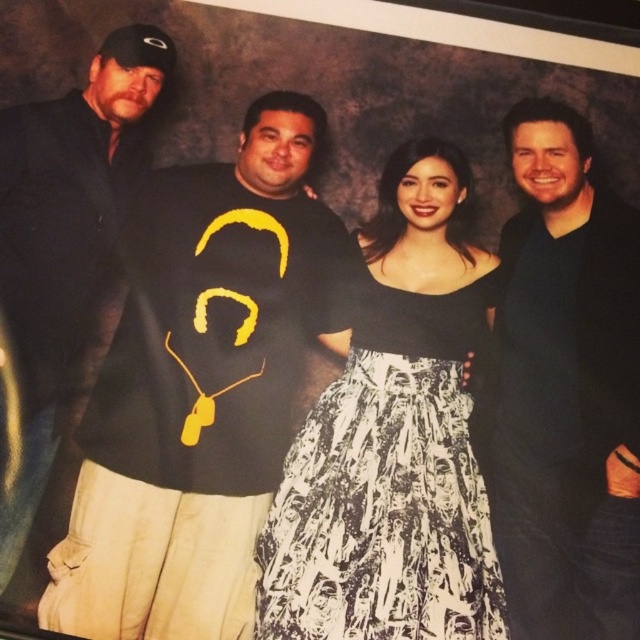
Question: Can you confirm if black matte t-shirt at center is smaller than black matte shirt at right?

Choices:
 (A) no
 (B) yes

Answer: (A)

Question: Which of the following is the farthest from the observer?

Choices:
 (A) black matte t-shirt at center
 (B) black matte jacket at upper left

Answer: (B)

Question: Which of the following is the closest to the observer?

Choices:
 (A) (92, 60)
 (B) (504, 241)

Answer: (A)

Question: From the image, what is the correct spatial relationship of black matte t-shirt at center in relation to black matte jacket at upper left?

Choices:
 (A) left
 (B) right

Answer: (B)

Question: Which point is closer to the camera taking this photo?

Choices:
 (A) (198, 560)
 (B) (84, 102)
 (C) (493, 477)

Answer: (A)

Question: Is black satin dress at center to the right of black matte shirt at right from the viewer's perspective?

Choices:
 (A) no
 (B) yes

Answer: (A)